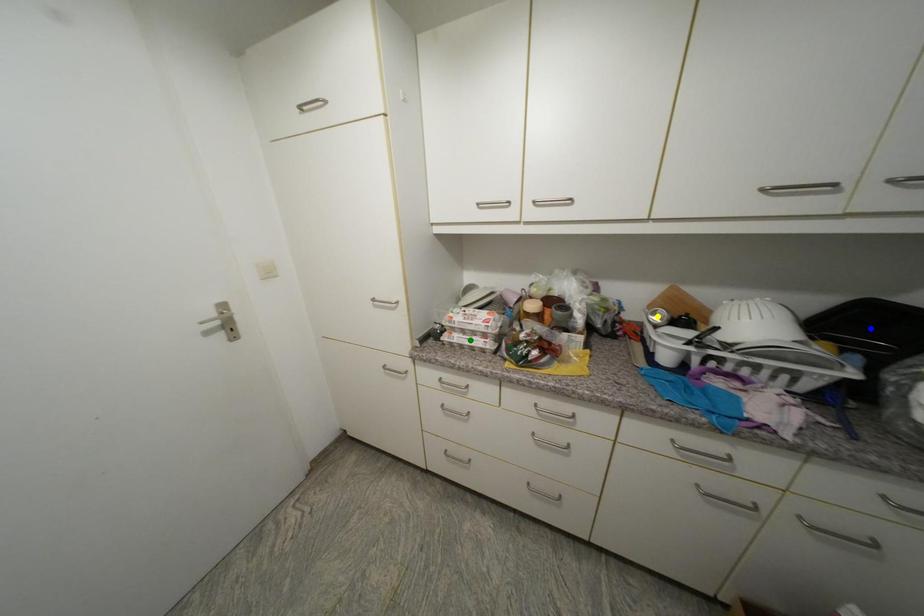
Order these from nearest to farthest:
green point | yellow point | blue point

blue point
green point
yellow point